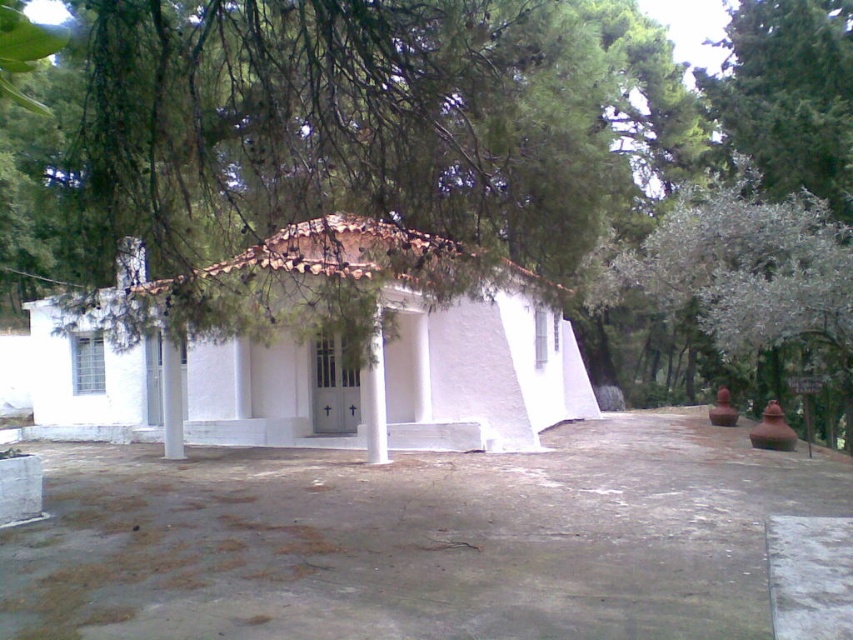
In the scene shown: Who is lower down, green leafy tree at center or white smooth hut at center?

white smooth hut at center is lower down.

Can you confirm if green leafy tree at center is smaller than white smooth hut at center?

Actually, green leafy tree at center might be larger than white smooth hut at center.

Locate an element on the screen. green leafy tree at center is located at coordinates (352, 138).

Is white smooth hut at center wider than white smooth column at center?

Yes, white smooth hut at center is wider than white smooth column at center.

Can you confirm if white smooth hut at center is taller than white smooth column at center?

Yes.

Is point (199, 378) farther from camera compared to point (380, 426)?

That is True.

I want to click on white smooth hut at center, so click(480, 372).

Between green leafy tree at center and white textured tree at right, which one has less height?

Standing shorter between the two is white textured tree at right.

What are the coordinates of `green leafy tree at center` in the screenshot? It's located at (352, 138).

I want to click on green leafy tree at center, so click(x=352, y=138).